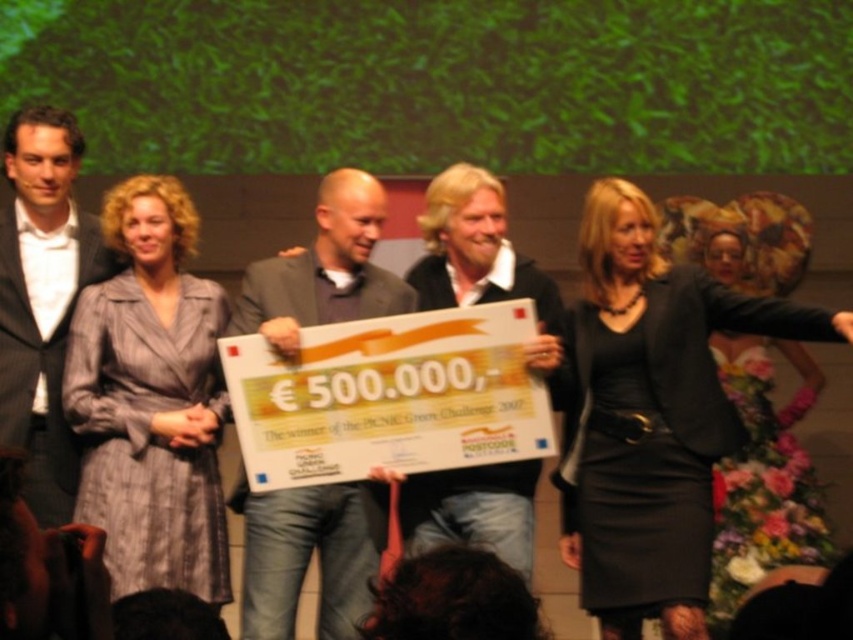
Can you confirm if matte gray suit at center is wider than matte black suit at left?

Yes, matte gray suit at center is wider than matte black suit at left.

Between matte gray suit at center and matte black suit at left, which one appears on the right side from the viewer's perspective?

From the viewer's perspective, matte gray suit at center appears more on the right side.

Is point (323, 323) closer to viewer compared to point (0, 401)?

No, it is behind (0, 401).

Identify the location of matte gray suit at center. This screenshot has height=640, width=853. (306, 556).

Can you confirm if matte black suit at left is thinner than matte black jacket at center?

Indeed, matte black suit at left has a lesser width compared to matte black jacket at center.

Is matte black suit at left further to the viewer compared to matte black jacket at center?

Yes, matte black suit at left is further from the viewer.

What do you see at coordinates (44, 298) in the screenshot? This screenshot has width=853, height=640. I see `matte black suit at left` at bounding box center [44, 298].

The width and height of the screenshot is (853, 640). I want to click on matte black suit at left, so click(x=44, y=298).

Can you confirm if black matte dress at center is positioned below matte black suit at left?

Indeed, black matte dress at center is positioned under matte black suit at left.

Who is more distant from viewer, [607,186] or [3,221]?

Point [3,221]

Between point (682, 481) and point (67, 236), which one is positioned behind?

The point (67, 236) is more distant.

Find the location of a particular element. The width and height of the screenshot is (853, 640). black matte dress at center is located at coordinates (650, 416).